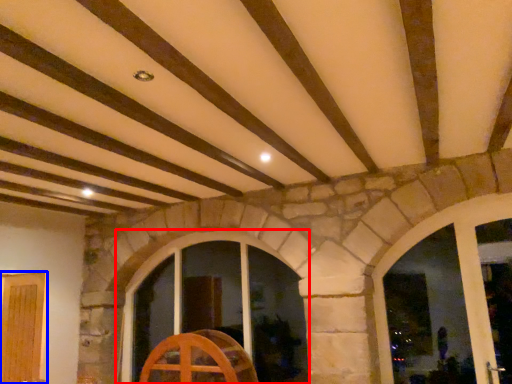
Question: Which object is closer to the camera taking this photo, window (highlighted by a red box) or door (highlighted by a blue box)?

Choices:
 (A) window
 (B) door

Answer: (B)